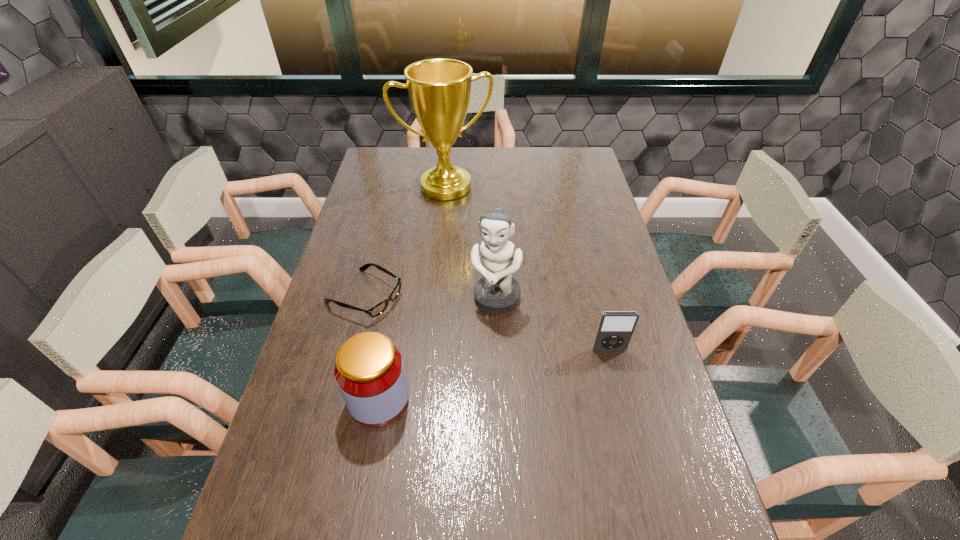
At what (x,y) coordinates should I click in order to perform the action: click on jar present at the left edge. Please return your answer as a coordinate pair (x, y). This screenshot has width=960, height=540. Looking at the image, I should click on (369, 371).

The image size is (960, 540). Find the location of `award that is positioned at the left edge`. award that is positioned at the left edge is located at coordinates (439, 90).

Locate an element on the screen. spectacles at the left edge is located at coordinates (375, 311).

Identify the location of object at the right edge. (615, 329).

Locate an element on the screen. object located in the far left corner section of the desktop is located at coordinates (439, 90).

Identify the location of vacant space at the far edge. This screenshot has height=540, width=960. (474, 176).

Where is `blank space at the near edge of the desktop`? blank space at the near edge of the desktop is located at coordinates (458, 509).

Locate an element on the screen. This screenshot has height=540, width=960. blank space at the left edge of the desktop is located at coordinates (285, 435).

In the image, there is a desktop. In order to click on vacant space at the right edge in this screenshot , I will do `click(587, 316)`.

This screenshot has width=960, height=540. I want to click on empty location between the farthest object and the nearest object, so click(412, 293).